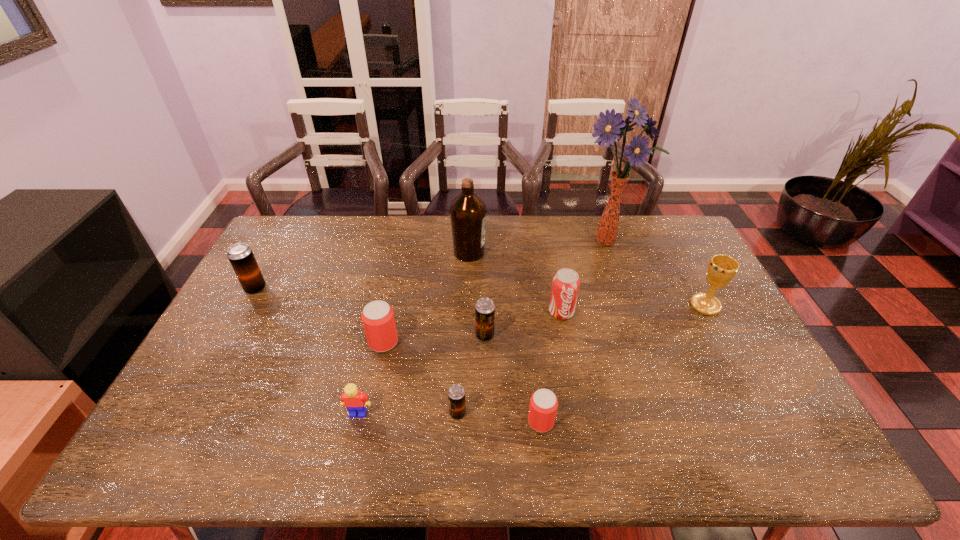
The image size is (960, 540). Identify the location of the second beer can from left to right. (378, 320).

In order to click on the farther red beer can in this screenshot , I will do `click(378, 320)`.

Where is `the second beer can from right to left`? the second beer can from right to left is located at coordinates (485, 308).

The height and width of the screenshot is (540, 960). Identify the location of the second nearest black beer can. (485, 308).

You are a GUI agent. You are given a task and a screenshot of the screen. Output one action in this format:
    pyautogui.click(x=<x>, y=<y>)
    Task: Click on the yellow Lego
    Image resolution: width=960 pixels, height=540 pixels.
    Given the screenshot: What is the action you would take?
    pyautogui.click(x=354, y=400)

The height and width of the screenshot is (540, 960). Find the location of `the nearer red beer can`. the nearer red beer can is located at coordinates (543, 406).

Find the location of a particular element. the fourth object from right to left is located at coordinates (543, 406).

Identify the location of the second black beer can from right to left. (456, 394).

Identify the location of the nearest black beer can. The image size is (960, 540). (456, 394).

Locate an element on the screen. The width and height of the screenshot is (960, 540). vacant space located on the front of the ninth object from left to right is located at coordinates (634, 317).